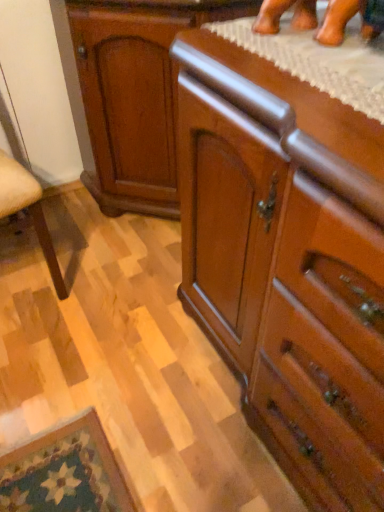
Question: Is glossy wood cabinet at center situated inside polished wood chest of drawers at center or outside?

Choices:
 (A) inside
 (B) outside

Answer: (B)

Question: From the image's perspective, is glossy wood cabinet at center above or below polished wood chest of drawers at center?

Choices:
 (A) below
 (B) above

Answer: (B)

Question: Based on their positions, is glossy wood cabinet at center located to the left or right of polished wood chest of drawers at center?

Choices:
 (A) left
 (B) right

Answer: (A)

Question: Is polished wood chest of drawers at center in front of or behind glossy wood cabinet at center in the image?

Choices:
 (A) front
 (B) behind

Answer: (A)

Question: Is polished wood chest of drawers at center taller or shorter than glossy wood cabinet at center?

Choices:
 (A) short
 (B) tall

Answer: (B)

Question: From a real-world perspective, relative to glossy wood cabinet at center, is polished wood chest of drawers at center vertically above or below?

Choices:
 (A) above
 (B) below

Answer: (B)

Question: Considering the positions of polished wood chest of drawers at center and glossy wood cabinet at center in the image, is polished wood chest of drawers at center bigger or smaller than glossy wood cabinet at center?

Choices:
 (A) big
 (B) small

Answer: (A)